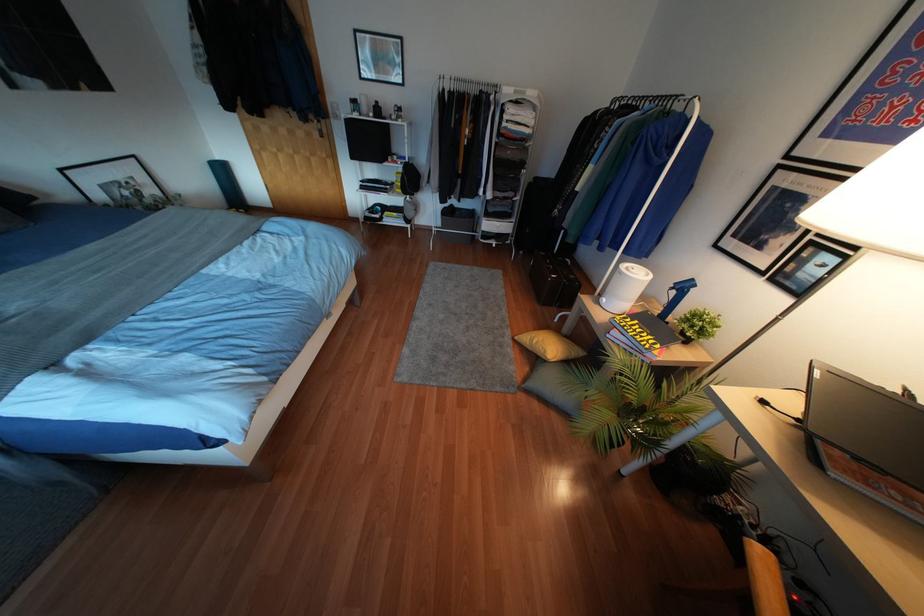
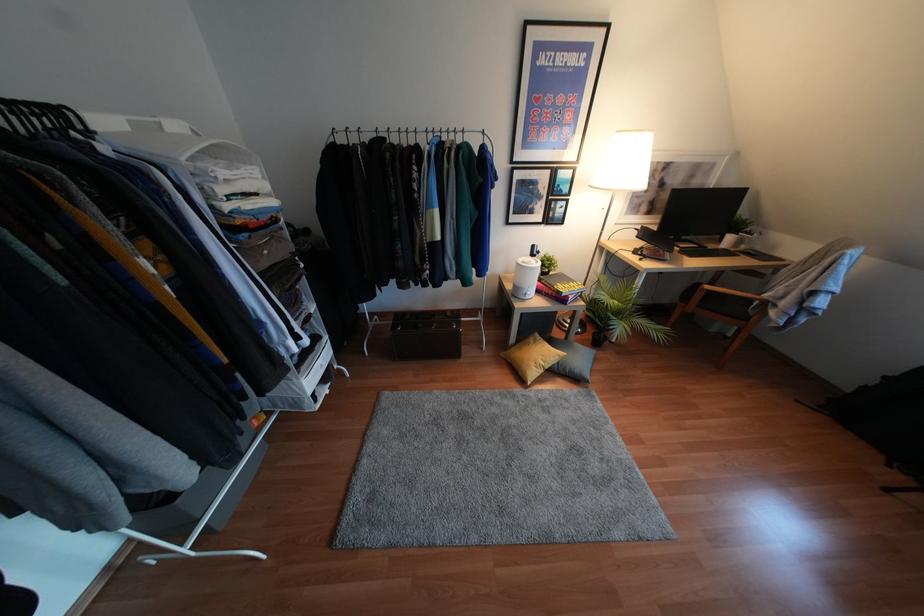
In the second image, find the point that corresponds to point (533, 341) in the first image.

(541, 363)